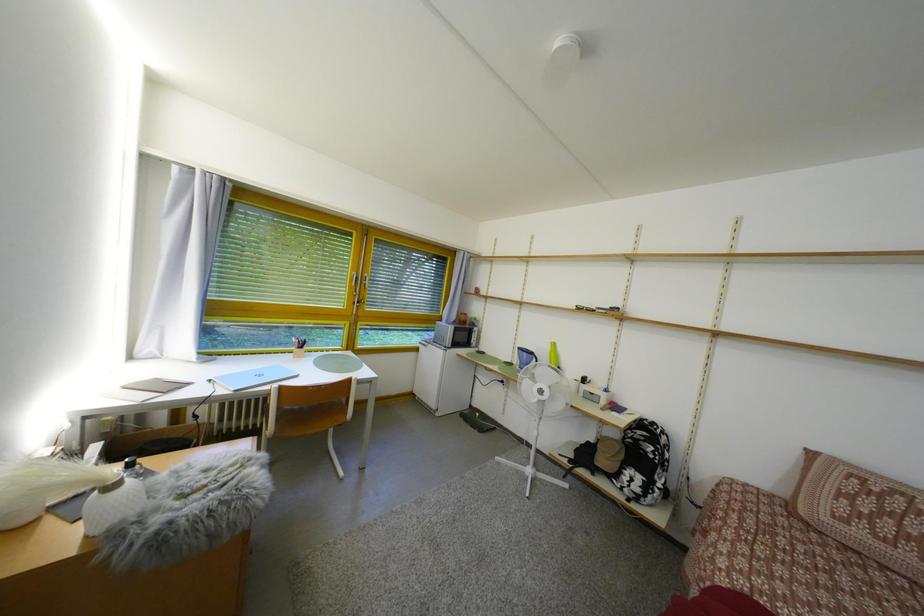
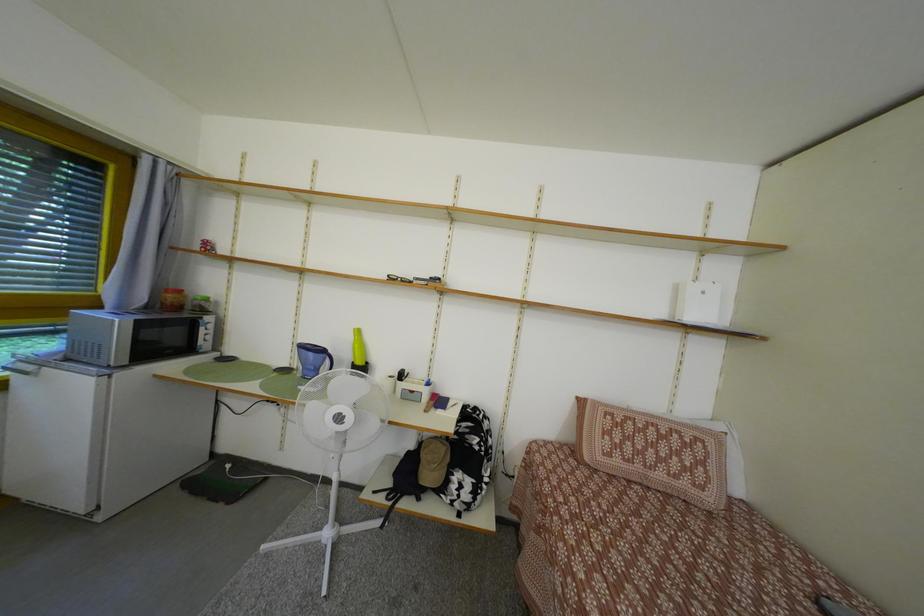
Question: The camera is either moving clockwise (left) or counter-clockwise (right) around the object. The first image is from the beginning of the video and the second image is from the end. Is the camera moving left or right when shooting the video?

Choices:
 (A) Left
 (B) Right

Answer: (A)